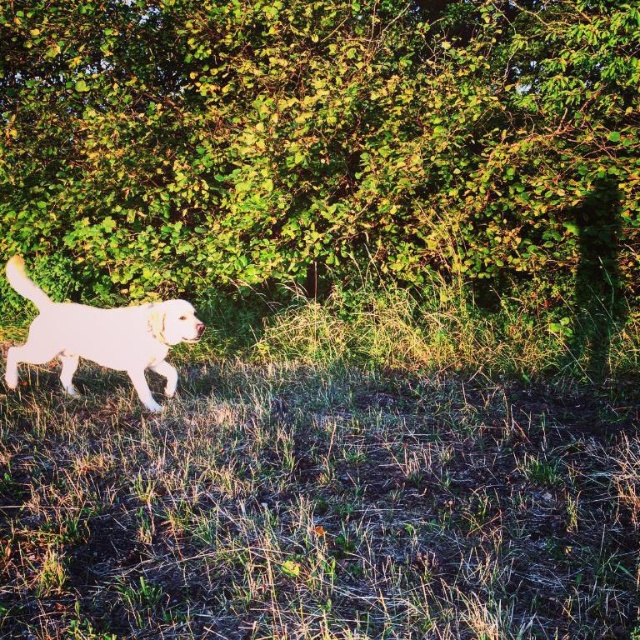
Can you confirm if green leafy bush at center is positioned to the right of white fur dog at center?

Yes, green leafy bush at center is to the right of white fur dog at center.

Between point (388, 12) and point (67, 326), which one is positioned behind?

Point (388, 12)

The width and height of the screenshot is (640, 640). What do you see at coordinates (321, 144) in the screenshot?
I see `green leafy bush at center` at bounding box center [321, 144].

The height and width of the screenshot is (640, 640). I want to click on green leafy bush at center, so click(321, 144).